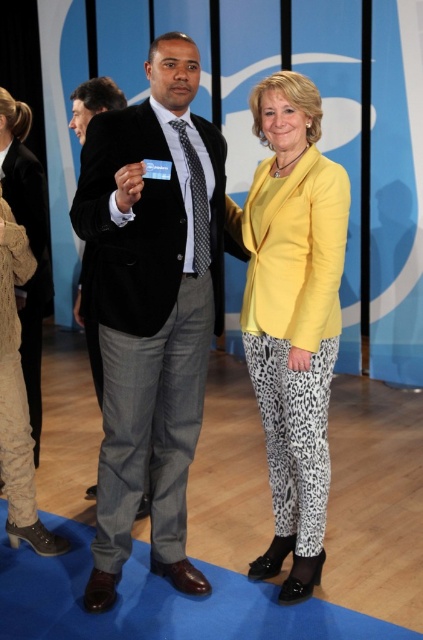
You are a fashion designer observing the stage setup for a presentation. You notice the velvet black coat at center and the matte black suit at center. Which one is taller in height?

The velvet black coat at center has a greater height compared to the matte black suit at center.

You are a photographer standing in front of the stage. You need to place a velvet black coat at center in the scene. Where should you place it? Please provide coordinates in the format of x,y between 0 and 1. The stage is represented as a coordinate system from 0 to 1 in both x and y axes.

The velvet black coat at center should be placed at coordinates (151,307) as specified in the description.